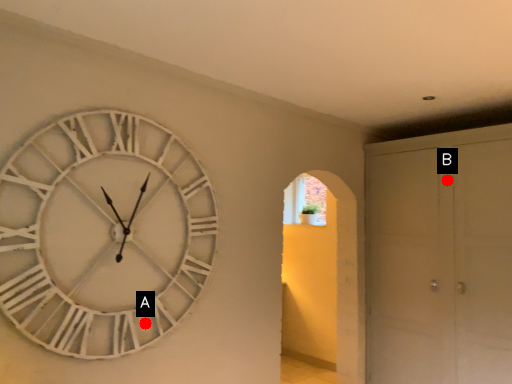
Question: Two points are circled on the image, labeled by A and B beside each circle. Which point is closer to the camera taking this photo?

Choices:
 (A) A is closer
 (B) B is closer

Answer: (A)